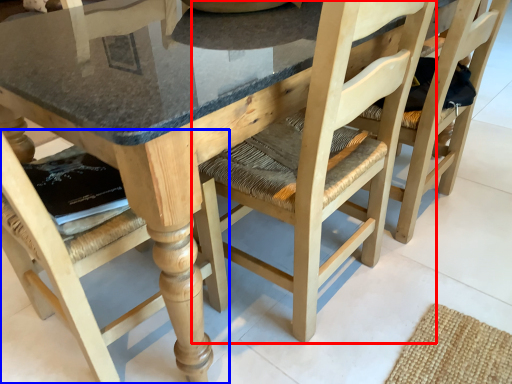
Question: Which of the following is the closest to the observer, chair (highlighted by a red box) or chair (highlighted by a blue box)?

Choices:
 (A) chair
 (B) chair

Answer: (B)